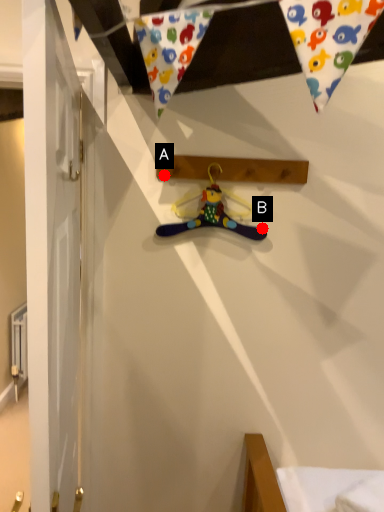
Question: Two points are circled on the image, labeled by A and B beside each circle. Which point is farther from the camera taking this photo?

Choices:
 (A) A is further
 (B) B is further

Answer: (B)